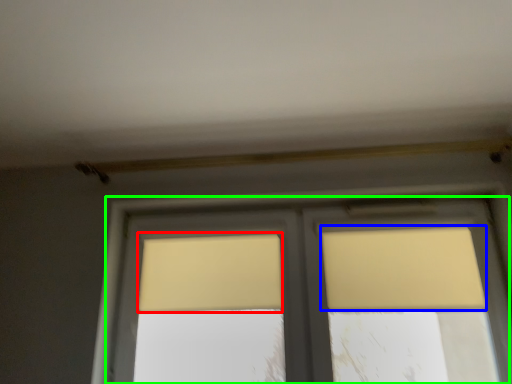
Question: Considering the real-world distances, which object is farthest from curtain (highlighted by a red box)? curtain (highlighted by a blue box) or window (highlighted by a green box)?

Choices:
 (A) curtain
 (B) window

Answer: (A)